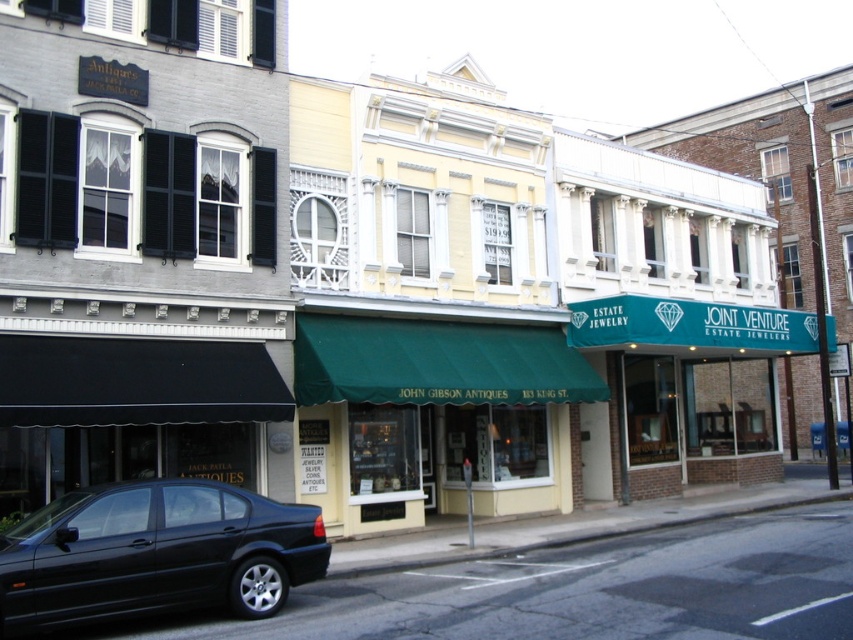
You are a delivery person who needs to park your vehicle in front of the central building. The central building has a green awning with the name John Gibson Antiques. You have a delivery van that is 6 meters long. The parking spot available is between the shiny black sedan at lower left and the building on the left. Is there enough space for your van?

The position of shiny black sedan at lower left is at point (x=155, y=554). Without knowing the exact dimensions of the parking area or the distance between the sedan and the building, it is impossible to determine if the van will fit. Additional information about the parking space length is required.

You are a customer looking for the antique shop named John Gibson Antiques. You see the green fabric awning at center and the teal fabric signboard at center. Which one should you look above to find the shop name?

The teal fabric signboard at center is located above the green fabric awning at center, so you should look above the green fabric awning at center to find the shop name displayed on the teal fabric signboard at center.